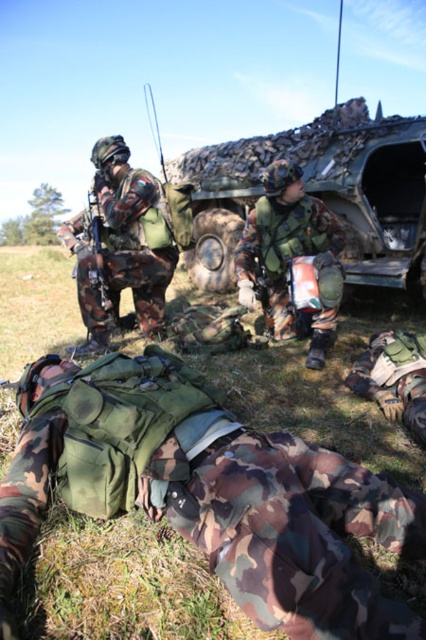
Question: Is camouflage fabric vest at lower center wider than camouflage fabric helmet at upper left?

Choices:
 (A) yes
 (B) no

Answer: (A)

Question: Among these points, which one is nearest to the camera?

Choices:
 (A) (247, 483)
 (B) (141, 284)
 (C) (256, 211)
 (D) (345, 115)

Answer: (A)

Question: Which of the following is the farthest from the observer?

Choices:
 (A) camouflage fabric vehicle at upper center
 (B) camouflage fabric vest at lower center

Answer: (A)

Question: Which of the following is the farthest from the observer?

Choices:
 (A) (92, 252)
 (B) (221, 216)

Answer: (B)

Question: Does camouflage fabric vehicle at upper center appear on the left side of camouflage fabric helmet at center?

Choices:
 (A) yes
 (B) no

Answer: (B)

Question: Does camouflage fabric vest at lower center appear on the right side of camouflage fabric vehicle at upper center?

Choices:
 (A) no
 (B) yes

Answer: (A)